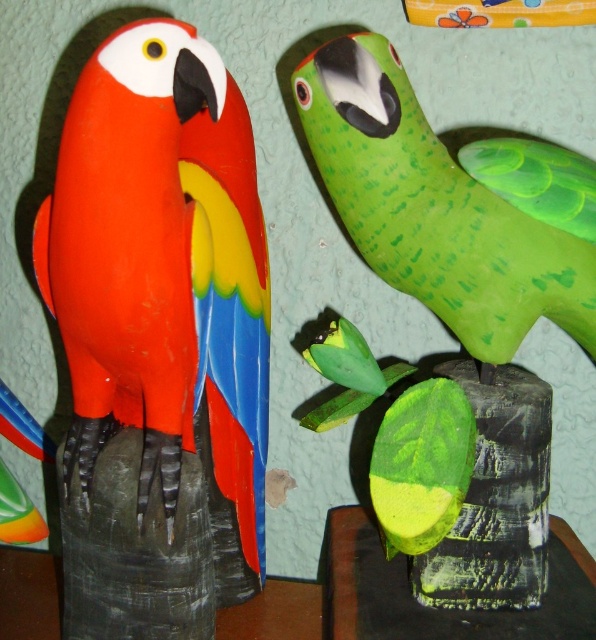
Question: Can you confirm if matte plastic parrot at left is wider than green matte parrot at upper right?

Choices:
 (A) yes
 (B) no

Answer: (B)

Question: Does matte plastic parrot at left appear over green matte parrot at upper right?

Choices:
 (A) no
 (B) yes

Answer: (A)

Question: Is matte plastic parrot at left wider than green matte parrot at upper right?

Choices:
 (A) no
 (B) yes

Answer: (A)

Question: Which object is closer to the camera taking this photo?

Choices:
 (A) matte plastic parrot at left
 (B) green matte parrot at upper right

Answer: (A)